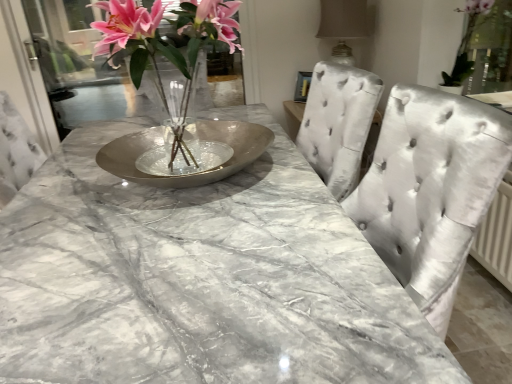
Measure the distance between satin beige lampshade at upper right and camera.

The depth of satin beige lampshade at upper right is 9.65 feet.

What is the approximate height of green leafy plant at upper right?

green leafy plant at upper right is 46.92 centimeters in height.

You are a GUI agent. You are given a task and a screenshot of the screen. Output one action in this format:
    pyautogui.click(x=<x>, y=<y>)
    Task: Click on the transparent glass door at upper left
    
    Given the screenshot: What is the action you would take?
    pyautogui.click(x=25, y=75)

Is green leafy plant at upper right smaller than silver metallic bowl at center?

Yes, green leafy plant at upper right is smaller than silver metallic bowl at center.

Between green leafy plant at upper right and silver metallic bowl at center, which one has smaller width?

green leafy plant at upper right is thinner.

Could you tell me if green leafy plant at upper right is turned towards silver metallic bowl at center?

No, green leafy plant at upper right is not oriented towards silver metallic bowl at center.

Which is closer, (464, 43) or (104, 164)?

Point (464, 43) is positioned farther from the camera compared to point (104, 164).

From the image's perspective, between metallic vase at center and silver metallic bowl at center, which one is located above?

From the image's view, metallic vase at center is above.

From a real-world perspective, is metallic vase at center positioned above or below silver metallic bowl at center?

metallic vase at center is situated higher than silver metallic bowl at center in the real world.

Can you confirm if silver metallic bowl at center is bigger than satin beige lampshade at upper right?

No.

How different are the orientations of silver metallic bowl at center and satin beige lampshade at upper right in degrees?

silver metallic bowl at center and satin beige lampshade at upper right are facing 0.000448 degrees away from each other.

Looking at their sizes, would you say silver metallic bowl at center is wider or thinner than satin beige lampshade at upper right?

Considering their sizes, silver metallic bowl at center looks broader than satin beige lampshade at upper right.

Is satin beige lampshade at upper right a part of silver metallic bowl at center?

No.

From a real-world perspective, relative to satin silver chair at center, is silver metallic bowl at center vertically above or below?

In terms of real-world spatial position, silver metallic bowl at center is above satin silver chair at center.

From the image's perspective, is silver metallic bowl at center beneath satin silver chair at center?

Correct, silver metallic bowl at center appears lower than satin silver chair at center in the image.

Relative to satin silver chair at center, is silver metallic bowl at center in front or behind?

Visually, silver metallic bowl at center is located in front of satin silver chair at center.

Is silver metallic bowl at center positioned far away from satin silver chair at center?

silver metallic bowl at center is actually quite close to satin silver chair at center.

From the image's perspective, which is above, satin beige lampshade at upper right or metallic vase at center?

satin beige lampshade at upper right appears higher in the image.

Is satin beige lampshade at upper right bigger than metallic vase at center?

No, satin beige lampshade at upper right is not bigger than metallic vase at center.

Considering the positions of objects satin beige lampshade at upper right and metallic vase at center in the image provided, who is in front, satin beige lampshade at upper right or metallic vase at center?

Positioned in front is metallic vase at center.

Is the surface of satin beige lampshade at upper right in direct contact with metallic vase at center?

No, satin beige lampshade at upper right is not next to metallic vase at center.

Is transparent glass door at upper left not within metallic vase at center?

Yes, transparent glass door at upper left is outside of metallic vase at center.

Is transparent glass door at upper left in contact with metallic vase at center?

transparent glass door at upper left is not next to metallic vase at center, and they're not touching.

Is the position of transparent glass door at upper left more distant than that of metallic vase at center?

Yes, transparent glass door at upper left is further from the viewer.

Is satin beige lampshade at upper right spatially inside green leafy plant at upper right, or outside of it?

satin beige lampshade at upper right lies outside green leafy plant at upper right.

At what (x,y) coordinates should I click in order to perform the action: click on lamp that is behind the green leafy plant at upper right. Please return your answer as a coordinate pair (x, y). This screenshot has height=384, width=512. Looking at the image, I should click on (343, 26).

Are satin beige lampshade at upper right and green leafy plant at upper right far apart?

satin beige lampshade at upper right is actually quite close to green leafy plant at upper right.

Can you tell me how much satin beige lampshade at upper right and green leafy plant at upper right differ in facing direction?

0.00124 degrees separate the facing orientations of satin beige lampshade at upper right and green leafy plant at upper right.

The height and width of the screenshot is (384, 512). In the image, there is a silver metallic bowl at center. In order to click on houseplant above it (from the image's perspective) in this screenshot , I will do `click(465, 47)`.

Where is `glass plate lying on the right of metallic vase at center`? Image resolution: width=512 pixels, height=384 pixels. glass plate lying on the right of metallic vase at center is located at coordinates (200, 138).

Estimate the real-world distances between objects in this image. Which object is closer to satin silver chair at center, transparent glass door at upper left or metallic vase at center?

The object closer to satin silver chair at center is metallic vase at center.

Looking at the image, which one is located closer to transparent glass door at upper left, green leafy plant at upper right or metallic vase at center?

Based on the image, metallic vase at center appears to be nearer to transparent glass door at upper left.

Based on the photo, from the image, which object appears to be nearer to green leafy plant at upper right, transparent glass door at upper left or metallic vase at center?

metallic vase at center.

Estimate the real-world distances between objects in this image. Which object is closer to green leafy plant at upper right, satin beige lampshade at upper right or transparent glass door at upper left?

Based on the image, satin beige lampshade at upper right appears to be nearer to green leafy plant at upper right.

From the image, which object appears to be nearer to satin silver chair at center, satin beige lampshade at upper right or green leafy plant at upper right?

green leafy plant at upper right is closer to satin silver chair at center.

Estimate the real-world distances between objects in this image. Which object is closer to silver metallic bowl at center, transparent glass door at upper left or green leafy plant at upper right?

transparent glass door at upper left.

Estimate the real-world distances between objects in this image. Which object is further from green leafy plant at upper right, transparent glass door at upper left or satin beige lampshade at upper right?

Based on the image, transparent glass door at upper left appears to be further to green leafy plant at upper right.

Based on their spatial positions, is metallic vase at center or satin beige lampshade at upper right closer to satin silver chair at center?

metallic vase at center.

This screenshot has width=512, height=384. In order to click on chair located between silver metallic bowl at center and transparent glass door at upper left in the depth direction in this screenshot , I will do `click(338, 123)`.

Image resolution: width=512 pixels, height=384 pixels. Identify the location of lamp between silver metallic bowl at center and satin silver chair at center along the z-axis. (343, 26).

Where is `chair positioned between metallic vase at center and transparent glass door at upper left from near to far`? chair positioned between metallic vase at center and transparent glass door at upper left from near to far is located at coordinates (338, 123).

You are a GUI agent. You are given a task and a screenshot of the screen. Output one action in this format:
    pyautogui.click(x=<x>, y=<y>)
    Task: Click on the lamp between green leafy plant at upper right and satin silver chair at center in the front-back direction
    This screenshot has width=512, height=384.
    Given the screenshot: What is the action you would take?
    pyautogui.click(x=343, y=26)